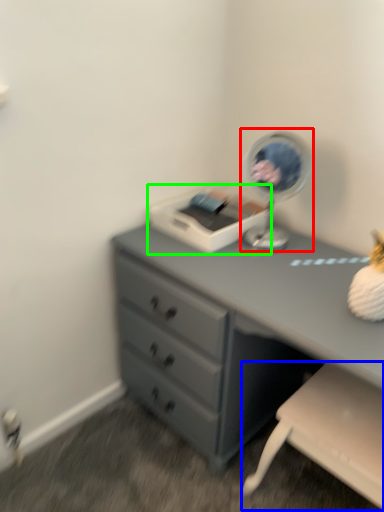
Question: Based on their relative distances, which object is farther from table lamp (highlighted by a red box)? Choose from swivel chair (highlighted by a blue box) and printer (highlighted by a green box).

Choices:
 (A) swivel chair
 (B) printer

Answer: (A)